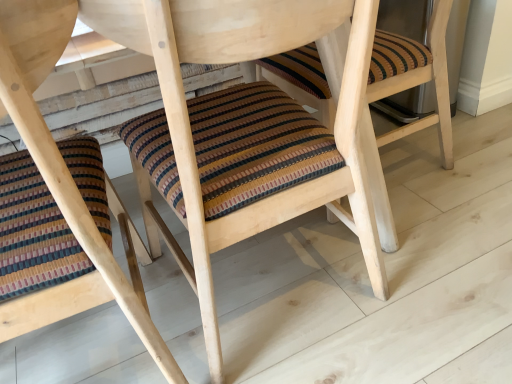
Question: Considering their positions, is striped fabric cushion at center, the 2th chair when ordered from left to right, located in front of or behind striped fabric cushion at lower left, positioned as the 1th chair in left-to-right order?

Choices:
 (A) front
 (B) behind

Answer: (B)

Question: Do you think striped fabric cushion at center, which is counted as the 1th chair, starting from the right, is within striped fabric cushion at lower left, acting as the 2th chair starting from the right, or outside of it?

Choices:
 (A) inside
 (B) outside

Answer: (B)

Question: Based on their sizes in the image, would you say striped fabric cushion at center, which is counted as the 1th chair, starting from the right, is bigger or smaller than striped fabric cushion at lower left, positioned as the 1th chair in left-to-right order?

Choices:
 (A) big
 (B) small

Answer: (A)

Question: In the image, is striped fabric cushion at lower left, positioned as the 1th chair in left-to-right order, positioned in front of or behind striped fabric cushion at center, the 2th chair when ordered from left to right?

Choices:
 (A) behind
 (B) front

Answer: (B)

Question: In terms of height, does striped fabric cushion at lower left, acting as the 2th chair starting from the right, look taller or shorter compared to striped fabric cushion at center, the 2th chair when ordered from left to right?

Choices:
 (A) tall
 (B) short

Answer: (A)

Question: From a real-world perspective, is striped fabric cushion at lower left, positioned as the 1th chair in left-to-right order, above or below striped fabric cushion at center, the 2th chair when ordered from left to right?

Choices:
 (A) above
 (B) below

Answer: (A)

Question: From the image's perspective, relative to striped fabric cushion at center, which is counted as the 1th chair, starting from the right, is striped fabric cushion at lower left, positioned as the 1th chair in left-to-right order, above or below?

Choices:
 (A) below
 (B) above

Answer: (A)